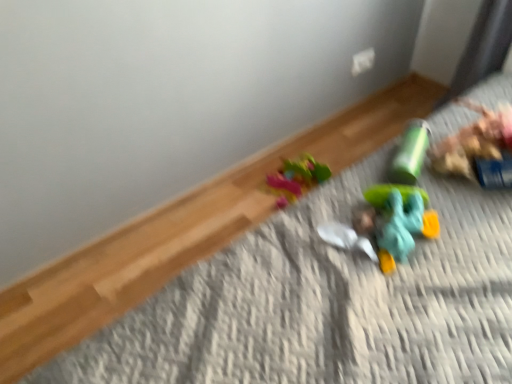
How much space does green matte cylinder at upper right, positioned as the 1th toy in top-to-bottom order, occupy horizontally?

It is 9.52 inches.

The height and width of the screenshot is (384, 512). Describe the element at coordinates (410, 153) in the screenshot. I see `green matte cylinder at upper right, marked as the 2th toy in a bottom-to-top arrangement` at that location.

Find the location of a particular element. This screenshot has width=512, height=384. green matte cylinder at upper right, positioned as the 1th toy in top-to-bottom order is located at coordinates (410, 153).

From the image's perspective, who appears lower, smooth plastic head at center or translucent teal toy at lower right, which ranks as the 2th toy in back-to-front order?

From the image's view, translucent teal toy at lower right, which ranks as the 2th toy in back-to-front order, is below.

Can you confirm if smooth plastic head at center is smaller than translucent teal toy at lower right, which ranks as the 1th toy in front-to-back order?

Yes.

Is smooth plastic head at center positioned far away from translucent teal toy at lower right, which ranks as the 2th toy in back-to-front order?

No, smooth plastic head at center is not far away from translucent teal toy at lower right, which ranks as the 2th toy in back-to-front order.

From the smooth plastic head at center, count 1st toy to the right and point to it. Please provide its 2D coordinates.

[(397, 221)]

Is smooth plastic head at center wider than green matte cylinder at upper right, marked as the 2th toy in a bottom-to-top arrangement?

In fact, smooth plastic head at center might be narrower than green matte cylinder at upper right, marked as the 2th toy in a bottom-to-top arrangement.

Considering the points (358, 234) and (426, 128), which point is in front, point (358, 234) or point (426, 128)?

The point (358, 234) is closer to the camera.

How different are the orientations of green matte cylinder at upper right, marked as the 2th toy in a bottom-to-top arrangement, and translucent teal toy at lower right, which ranks as the 2th toy in back-to-front order, in degrees?

The facing directions of green matte cylinder at upper right, marked as the 2th toy in a bottom-to-top arrangement, and translucent teal toy at lower right, which ranks as the 2th toy in back-to-front order, are 17.3 degrees apart.

Which of these two, green matte cylinder at upper right, which is counted as the first toy, starting from the back, or translucent teal toy at lower right, which is the 2th toy from top to bottom, stands shorter?

translucent teal toy at lower right, which is the 2th toy from top to bottom, is shorter.

From the image's perspective, would you say green matte cylinder at upper right, which is counted as the first toy, starting from the back, is shown under translucent teal toy at lower right, which ranks as the 1th toy in front-to-back order?

Incorrect, from the image's perspective, green matte cylinder at upper right, which is counted as the first toy, starting from the back, is higher than translucent teal toy at lower right, which ranks as the 1th toy in front-to-back order.

In terms of size, does green matte cylinder at upper right, which is counted as the first toy, starting from the back, appear bigger or smaller than translucent teal toy at lower right, which is the 2th toy from top to bottom?

In the image, green matte cylinder at upper right, which is counted as the first toy, starting from the back, appears to be smaller than translucent teal toy at lower right, which is the 2th toy from top to bottom.

Can you see green matte cylinder at upper right, acting as the second toy starting from the front, touching smooth plastic head at center?

They are not placed beside each other.

Is green matte cylinder at upper right, marked as the 2th toy in a bottom-to-top arrangement, wider than smooth plastic head at center?

Yes, green matte cylinder at upper right, marked as the 2th toy in a bottom-to-top arrangement, is wider than smooth plastic head at center.

Considering the sizes of green matte cylinder at upper right, positioned as the 1th toy in top-to-bottom order, and smooth plastic head at center in the image, is green matte cylinder at upper right, positioned as the 1th toy in top-to-bottom order, bigger or smaller than smooth plastic head at center?

Clearly, green matte cylinder at upper right, positioned as the 1th toy in top-to-bottom order, is larger in size than smooth plastic head at center.

Can you tell me how much green matte cylinder at upper right, marked as the 2th toy in a bottom-to-top arrangement, and smooth plastic head at center differ in facing direction?

The angle between the facing direction of green matte cylinder at upper right, marked as the 2th toy in a bottom-to-top arrangement, and the facing direction of smooth plastic head at center is 42 degrees.

Which is more to the right, translucent teal toy at lower right, the 1th toy when ordered from bottom to top, or smooth plastic head at center?

From the viewer's perspective, translucent teal toy at lower right, the 1th toy when ordered from bottom to top, appears more on the right side.

Considering the sizes of translucent teal toy at lower right, which ranks as the 1th toy in front-to-back order, and smooth plastic head at center in the image, is translucent teal toy at lower right, which ranks as the 1th toy in front-to-back order, wider or thinner than smooth plastic head at center?

Considering their sizes, translucent teal toy at lower right, which ranks as the 1th toy in front-to-back order, looks broader than smooth plastic head at center.

Considering the sizes of translucent teal toy at lower right, which ranks as the 2th toy in back-to-front order, and smooth plastic head at center in the image, is translucent teal toy at lower right, which ranks as the 2th toy in back-to-front order, taller or shorter than smooth plastic head at center?

Clearly, translucent teal toy at lower right, which ranks as the 2th toy in back-to-front order, is taller compared to smooth plastic head at center.

From a real-world perspective, is translucent teal toy at lower right, which is the 2th toy from top to bottom, positioned under smooth plastic head at center based on gravity?

No.

From their relative heights in the image, would you say translucent teal toy at lower right, which ranks as the 2th toy in back-to-front order, is taller or shorter than green matte cylinder at upper right, which is counted as the first toy, starting from the back?

translucent teal toy at lower right, which ranks as the 2th toy in back-to-front order, is shorter than green matte cylinder at upper right, which is counted as the first toy, starting from the back.

Which object is positioned more to the left, translucent teal toy at lower right, the 1th toy when ordered from bottom to top, or green matte cylinder at upper right, which is counted as the first toy, starting from the back?

translucent teal toy at lower right, the 1th toy when ordered from bottom to top, is more to the left.

Is translucent teal toy at lower right, which ranks as the 2th toy in back-to-front order, positioned with its back to green matte cylinder at upper right, which is counted as the first toy, starting from the back?

Yes.

Does translucent teal toy at lower right, the 1th toy when ordered from bottom to top, have a larger size compared to green matte cylinder at upper right, acting as the second toy starting from the front?

Yes.

Where is `toy in front of the smooth plastic head at center`? The image size is (512, 384). toy in front of the smooth plastic head at center is located at coordinates (397, 221).

Identify the location of toy behind the smooth plastic head at center. (410, 153).

Looking at the image, which one is located closer to green matte cylinder at upper right, positioned as the 1th toy in top-to-bottom order, translucent teal toy at lower right, which ranks as the 2th toy in back-to-front order, or smooth plastic head at center?

translucent teal toy at lower right, which ranks as the 2th toy in back-to-front order, is closer to green matte cylinder at upper right, positioned as the 1th toy in top-to-bottom order.

From the image, which object appears to be nearer to translucent teal toy at lower right, which ranks as the 2th toy in back-to-front order, smooth plastic head at center or green matte cylinder at upper right, which is counted as the first toy, starting from the back?

smooth plastic head at center is closer to translucent teal toy at lower right, which ranks as the 2th toy in back-to-front order.

Looking at the image, which one is located closer to smooth plastic head at center, translucent teal toy at lower right, the 1th toy when ordered from bottom to top, or green matte cylinder at upper right, positioned as the 1th toy in top-to-bottom order?

The object closer to smooth plastic head at center is translucent teal toy at lower right, the 1th toy when ordered from bottom to top.

Considering their positions, is green matte cylinder at upper right, acting as the second toy starting from the front, positioned further to translucent teal toy at lower right, which is the 2th toy from top to bottom, than smooth plastic head at center?

green matte cylinder at upper right, acting as the second toy starting from the front, is further to translucent teal toy at lower right, which is the 2th toy from top to bottom.

From the image, which object appears to be nearer to smooth plastic head at center, green matte cylinder at upper right, acting as the second toy starting from the front, or translucent teal toy at lower right, which is the 2th toy from top to bottom?

translucent teal toy at lower right, which is the 2th toy from top to bottom, is positioned closer to the anchor smooth plastic head at center.

Considering their positions, is smooth plastic head at center positioned closer to green matte cylinder at upper right, acting as the second toy starting from the front, than translucent teal toy at lower right, which ranks as the 1th toy in front-to-back order?

The object closer to green matte cylinder at upper right, acting as the second toy starting from the front, is translucent teal toy at lower right, which ranks as the 1th toy in front-to-back order.

Find the location of a particular element. The width and height of the screenshot is (512, 384). head that lies between green matte cylinder at upper right, which is counted as the first toy, starting from the back, and translucent teal toy at lower right, which ranks as the 1th toy in front-to-back order, from top to bottom is located at coordinates (364, 218).